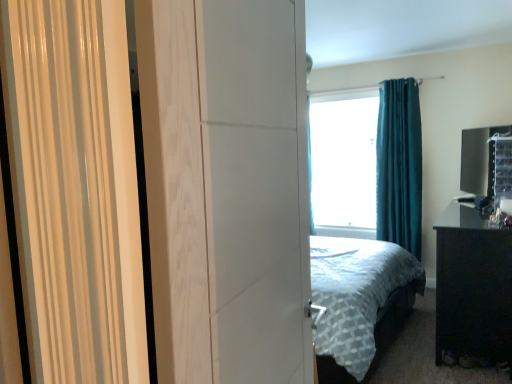
Question: Should I look upward or downward to see black glossy nightstand at right?

Choices:
 (A) up
 (B) down

Answer: (B)

Question: Would you say teal velvet curtain at upper right is a long distance from black glossy nightstand at right?

Choices:
 (A) no
 (B) yes

Answer: (B)

Question: Considering the relative positions of teal velvet curtain at upper right and black glossy nightstand at right in the image provided, is teal velvet curtain at upper right to the right of black glossy nightstand at right from the viewer's perspective?

Choices:
 (A) no
 (B) yes

Answer: (A)

Question: Is teal velvet curtain at upper right not inside black glossy nightstand at right?

Choices:
 (A) yes
 (B) no

Answer: (A)

Question: From the image's perspective, does teal velvet curtain at upper right appear lower than black glossy nightstand at right?

Choices:
 (A) yes
 (B) no

Answer: (B)

Question: Considering the relative sizes of teal velvet curtain at upper right and black glossy nightstand at right in the image provided, is teal velvet curtain at upper right smaller than black glossy nightstand at right?

Choices:
 (A) yes
 (B) no

Answer: (A)

Question: Does teal velvet curtain at upper right touch black glossy nightstand at right?

Choices:
 (A) no
 (B) yes

Answer: (A)

Question: From a real-world perspective, is transparent glass window screen at center located beneath teal velvet curtain at upper right?

Choices:
 (A) yes
 (B) no

Answer: (B)

Question: Considering the relative positions of transparent glass window screen at center and teal velvet curtain at upper right in the image provided, is transparent glass window screen at center behind teal velvet curtain at upper right?

Choices:
 (A) yes
 (B) no

Answer: (A)

Question: Is there a large distance between transparent glass window screen at center and teal velvet curtain at upper right?

Choices:
 (A) yes
 (B) no

Answer: (B)

Question: Can you confirm if transparent glass window screen at center is taller than teal velvet curtain at upper right?

Choices:
 (A) yes
 (B) no

Answer: (B)

Question: From the image's perspective, does transparent glass window screen at center appear lower than teal velvet curtain at upper right?

Choices:
 (A) yes
 (B) no

Answer: (B)

Question: Is transparent glass window screen at center closer to camera compared to teal velvet curtain at upper right?

Choices:
 (A) no
 (B) yes

Answer: (A)

Question: Is white matte screen door at center oriented towards teal velvet curtain at upper right?

Choices:
 (A) yes
 (B) no

Answer: (B)